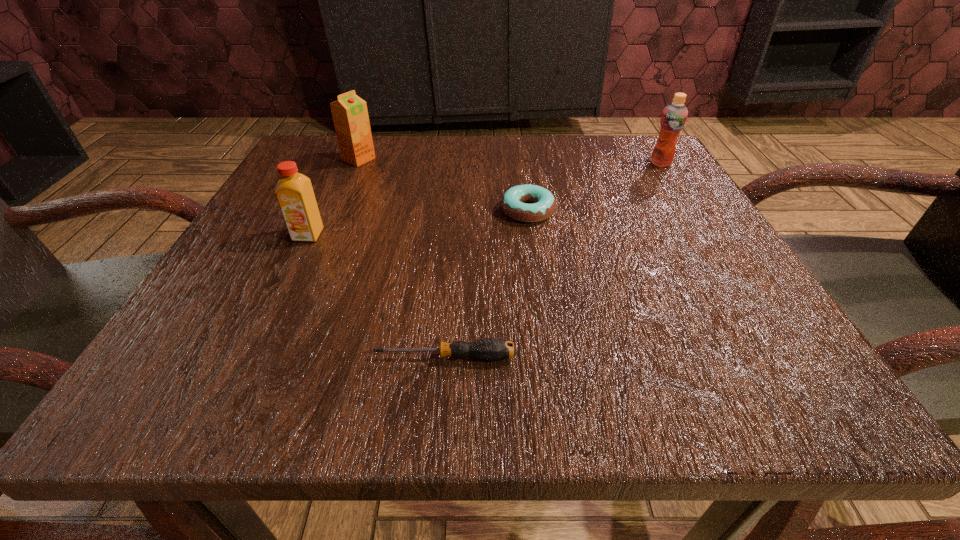
Where is `object present at the right edge`? object present at the right edge is located at coordinates (673, 119).

This screenshot has height=540, width=960. I want to click on object at the far left corner, so click(x=350, y=116).

Locate an element on the screen. This screenshot has width=960, height=540. object present at the far right corner is located at coordinates point(673,119).

In the image, there is a desktop. Identify the location of free space at the far edge. (449, 165).

I want to click on vacant space at the near edge, so click(x=642, y=356).

Locate an element on the screen. vacant space at the left edge of the desktop is located at coordinates (245, 230).

Where is `vacant region at the right edge of the desktop`? The height and width of the screenshot is (540, 960). vacant region at the right edge of the desktop is located at coordinates (756, 289).

Locate an element on the screen. The height and width of the screenshot is (540, 960). vacant space at the far left corner of the desktop is located at coordinates [344, 161].

Identify the location of free space at the near left corner of the desktop. Image resolution: width=960 pixels, height=540 pixels. coord(271,384).

I want to click on free space at the far right corner of the desktop, so click(627, 140).